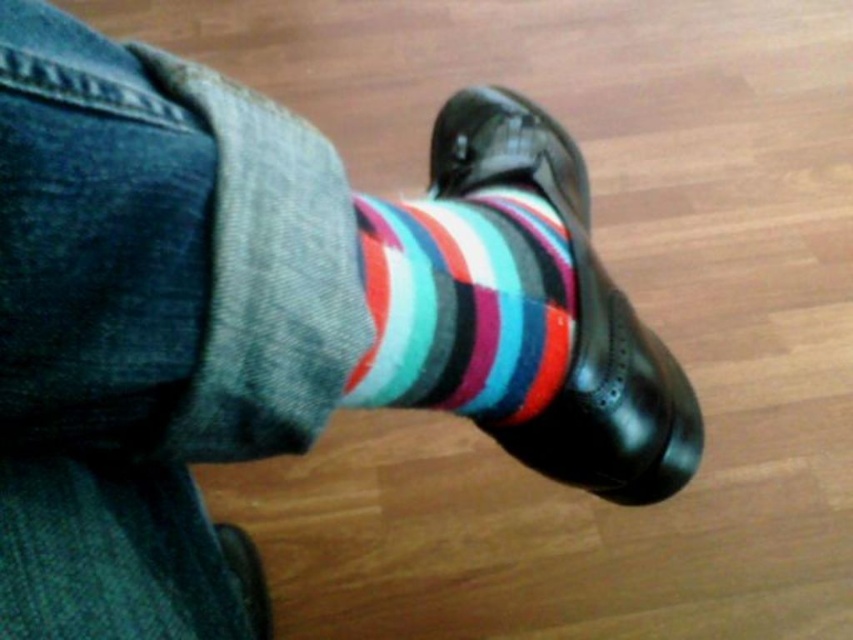
How distant is multicolored striped sock at lower center from shiny black shoe at center?

A distance of 3.37 inches exists between multicolored striped sock at lower center and shiny black shoe at center.

Does point (482, 205) lie in front of point (563, 156)?

Yes.

I want to click on multicolored striped sock at lower center, so click(x=463, y=305).